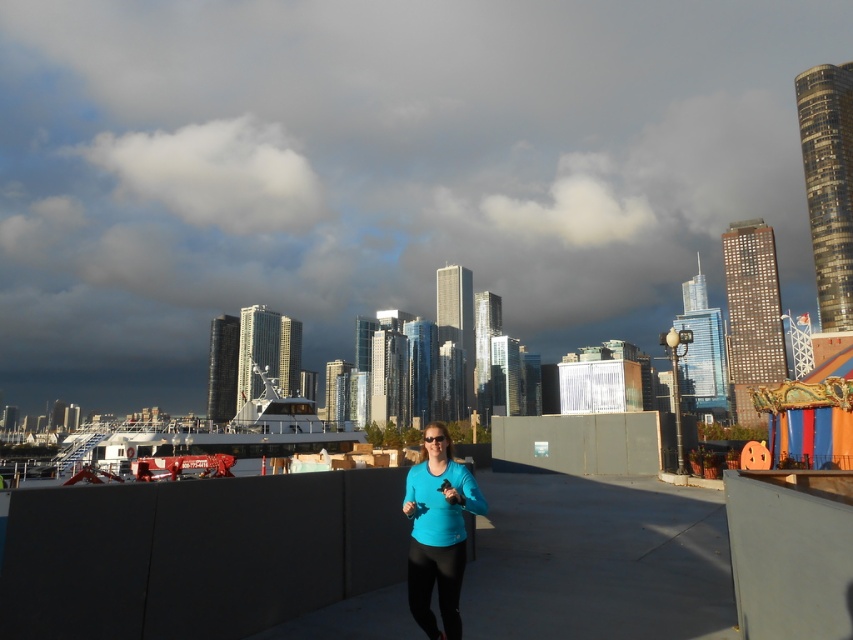
Consider the image. You are a photographer aiming to capture the white fluffy cloud at upper left without including the ship in the frame. Based on their positions, is it possible to adjust your camera angle to exclude the ship while still including the cloud?

The white fluffy cloud at upper left is located at point (215, 173), which is in the upper left area of the image. Since the ship is in the midground near the waterfront, adjusting the camera angle to focus on the upper left corner should allow you to exclude the ship while capturing the cloud.